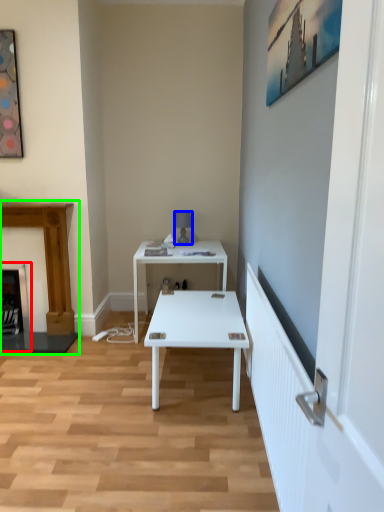
Question: Based on their relative distances, which object is nearer to fireplace (highlighted by a red box)? Choose from lamp (highlighted by a blue box) and fireplace (highlighted by a green box).

Choices:
 (A) lamp
 (B) fireplace

Answer: (B)